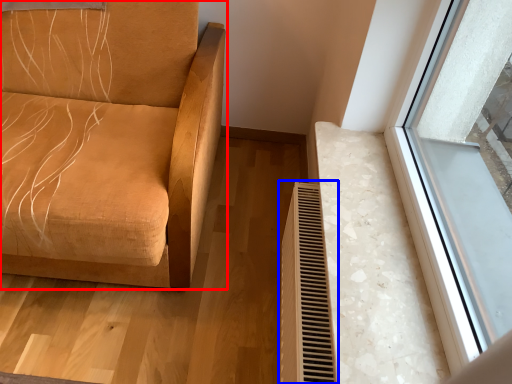
Question: Which of the following is the farthest to the observer, furniture (highlighted by a red box) or radiator (highlighted by a blue box)?

Choices:
 (A) furniture
 (B) radiator

Answer: (B)